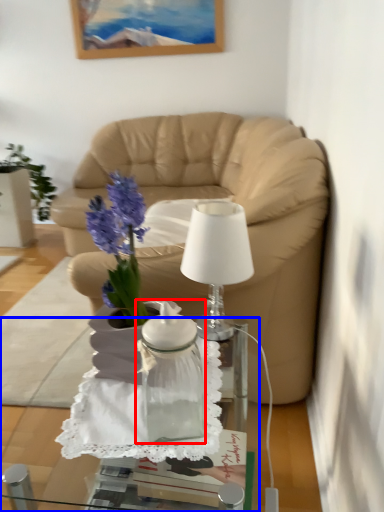
Question: Among these objects, which one is farthest to the camera, vase (highlighted by a red box) or desk (highlighted by a blue box)?

Choices:
 (A) vase
 (B) desk

Answer: (A)